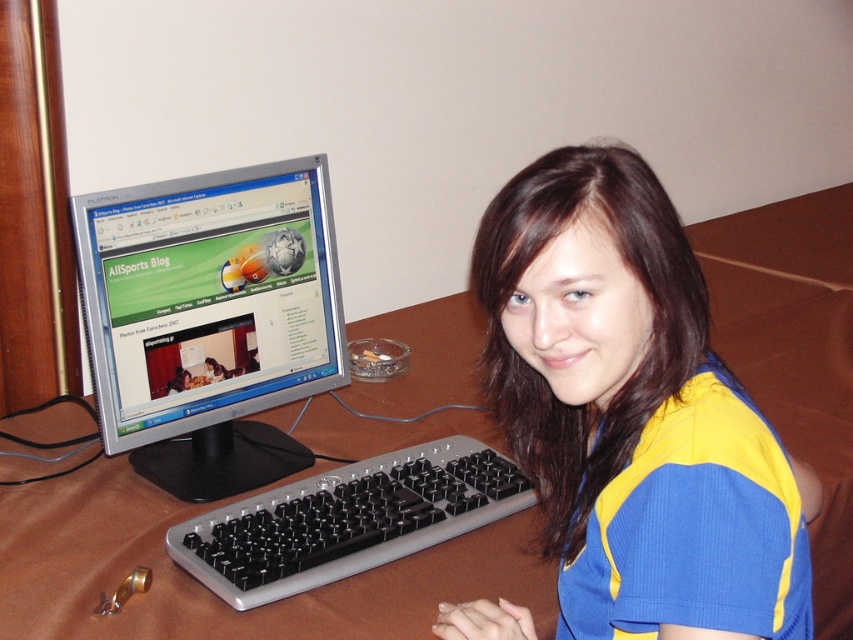
You are organizing a small event and need to place a 1.2 meter long banner on the desk. Given the size of the brown wooden computer desk at center and the satin silver monitor at center, will there be enough space to lay the banner horizontally without overlapping the monitor?

The brown wooden computer desk at center is larger than the satin silver monitor at center. However, the description does not provide specific measurements of the desk or monitor, so it is uncertain if the 1.2 meter banner can fit without overlapping the monitor. Additional information about the desk dimensions would be needed to determine this.

You are a delivery robot navigating to the desk. There are two points on your path. The first point is at point (259,444) and the second point is at point (450,481). Which point should you reach first to follow the correct path?

You should reach point (259,444) first because it is behind point (450,481), meaning it comes before the second point in the path.